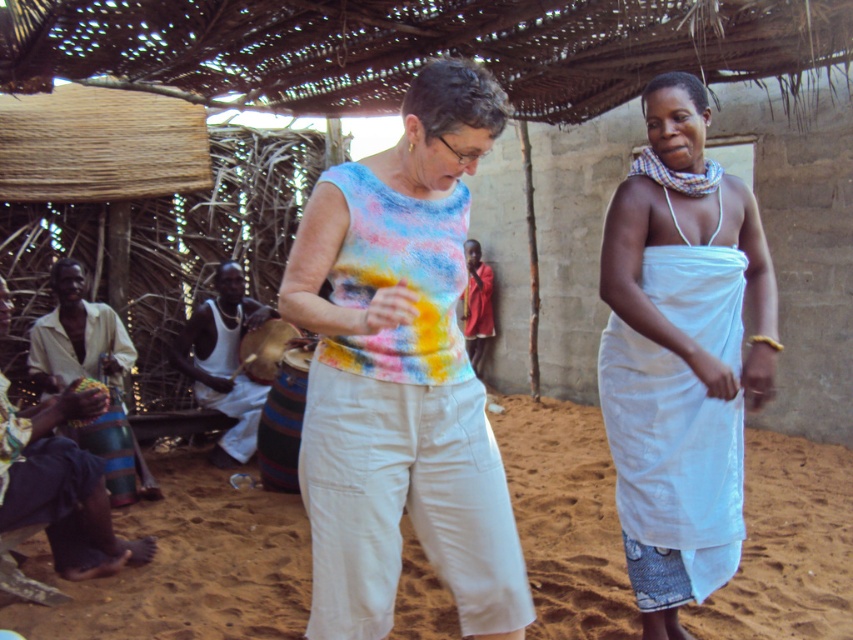
Can you confirm if white cloth drum at lower left is thinner than red fabric shirt at center?

In fact, white cloth drum at lower left might be wider than red fabric shirt at center.

Between white cloth drum at lower left and red fabric shirt at center, which one is positioned lower?

white cloth drum at lower left is lower down.

Is point (225, 381) positioned before point (474, 244)?

Yes, point (225, 381) is in front of point (474, 244).

I want to click on white cloth drum at lower left, so click(224, 362).

Can you confirm if beige sand at lower center is shorter than red fabric shirt at center?

Correct, beige sand at lower center is not as tall as red fabric shirt at center.

Where is `beige sand at lower center`? The height and width of the screenshot is (640, 853). beige sand at lower center is located at coordinates (189, 566).

Who is lower down, multicolored tie-dye tank top at center or white cloth at center?

white cloth at center

Describe the element at coordinates (401, 374) in the screenshot. I see `multicolored tie-dye tank top at center` at that location.

You are a GUI agent. You are given a task and a screenshot of the screen. Output one action in this format:
    pyautogui.click(x=<x>, y=<y>)
    Task: Click on the multicolored tie-dye tank top at center
    
    Given the screenshot: What is the action you would take?
    pyautogui.click(x=401, y=374)

The width and height of the screenshot is (853, 640). I want to click on multicolored tie-dye tank top at center, so click(401, 374).